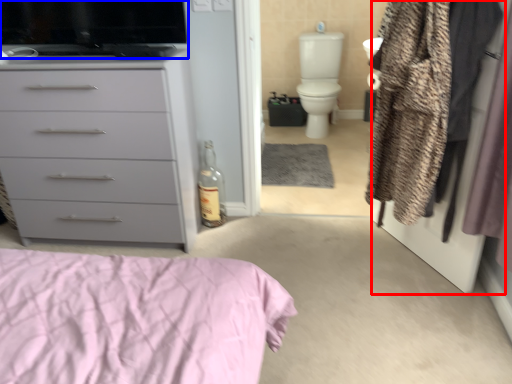
Question: Which point is closer to the camera, screen door (highlighted by a red box) or appliance (highlighted by a blue box)?

Choices:
 (A) screen door
 (B) appliance

Answer: (A)